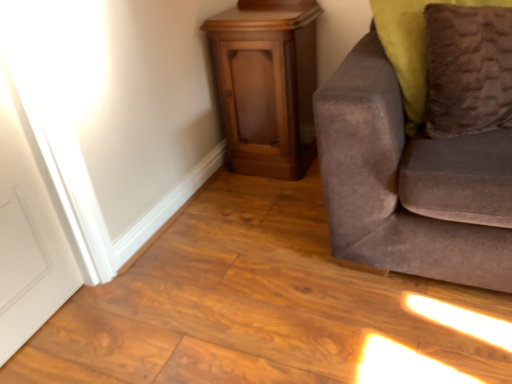
What do you see at coordinates (266, 84) in the screenshot? I see `wooden cabinet at center` at bounding box center [266, 84].

Describe the element at coordinates (467, 69) in the screenshot. The width and height of the screenshot is (512, 384). I see `brown fuzzy pillow at right` at that location.

Image resolution: width=512 pixels, height=384 pixels. Identify the location of wooden cabinet at center. (266, 84).

From the image's perspective, is suede gray couch at right located above wooden cabinet at center?

Incorrect, from the image's perspective, suede gray couch at right is lower than wooden cabinet at center.

Locate an element on the screen. The width and height of the screenshot is (512, 384). studio couch located in front of the wooden cabinet at center is located at coordinates (410, 182).

From the picture: Measure the distance between suede gray couch at right and wooden cabinet at center.

suede gray couch at right and wooden cabinet at center are 28.93 inches apart.

Is suede gray couch at right to the left of wooden cabinet at center from the viewer's perspective?

No, suede gray couch at right is not to the left of wooden cabinet at center.

In terms of height, does wooden cabinet at center look taller or shorter compared to brown fuzzy pillow at right?

In the image, wooden cabinet at center appears to be taller than brown fuzzy pillow at right.

Is wooden cabinet at center completely or partially outside of brown fuzzy pillow at right?

Indeed, wooden cabinet at center is completely outside brown fuzzy pillow at right.

Is the position of wooden cabinet at center less distant than that of brown fuzzy pillow at right?

No, it is not.

Is the surface of wooden cabinet at center in direct contact with brown fuzzy pillow at right?

No.

Consider the image. Can you tell me how much brown fuzzy pillow at right and wooden cabinet at center differ in facing direction?

39.7 degrees.

How much distance is there between brown fuzzy pillow at right and wooden cabinet at center?

brown fuzzy pillow at right and wooden cabinet at center are 30.35 inches apart.

From a real-world perspective, is brown fuzzy pillow at right over wooden cabinet at center?

Yes, from a real-world perspective, brown fuzzy pillow at right is on top of wooden cabinet at center.

Considering the sizes of objects brown fuzzy pillow at right and wooden cabinet at center in the image provided, who is wider, brown fuzzy pillow at right or wooden cabinet at center?

Wider between the two is wooden cabinet at center.

Based on the photo, is suede gray couch at right smaller than brown fuzzy pillow at right?

No.

This screenshot has width=512, height=384. Identify the location of studio couch that is on the left side of brown fuzzy pillow at right. (410, 182).

From the image's perspective, relative to brown fuzzy pillow at right, is suede gray couch at right above or below?

suede gray couch at right is situated lower than brown fuzzy pillow at right in the image.

In the scene shown: Are suede gray couch at right and brown fuzzy pillow at right making contact?

No, suede gray couch at right is not beside brown fuzzy pillow at right.

Is point (285, 100) positioned behind point (431, 240)?

Yes, it is behind point (431, 240).

Where is `studio couch on the right side of wooden cabinet at center`? This screenshot has height=384, width=512. studio couch on the right side of wooden cabinet at center is located at coordinates point(410,182).

Based on their sizes in the image, would you say wooden cabinet at center is bigger or smaller than suede gray couch at right?

Considering their sizes, wooden cabinet at center takes up less space than suede gray couch at right.

Based on the photo, from the image's perspective, which object appears higher, wooden cabinet at center or suede gray couch at right?

wooden cabinet at center appears higher in the image.

Could you tell me if brown fuzzy pillow at right is facing suede gray couch at right?

Yes, brown fuzzy pillow at right faces towards suede gray couch at right.

Is brown fuzzy pillow at right not close to suede gray couch at right?

No.

From a real-world perspective, which is physically above, brown fuzzy pillow at right or suede gray couch at right?

brown fuzzy pillow at right, from a real-world perspective.

From the image's perspective, would you say brown fuzzy pillow at right is positioned over suede gray couch at right?

Yes, from the image's perspective, brown fuzzy pillow at right is over suede gray couch at right.

Identify the location of studio couch in front of the wooden cabinet at center. Image resolution: width=512 pixels, height=384 pixels. (410, 182).

Locate an element on the screen. This screenshot has height=384, width=512. pillow that is on the right side of wooden cabinet at center is located at coordinates (467, 69).

Looking at this image, when comparing their distances from brown fuzzy pillow at right, does suede gray couch at right or wooden cabinet at center seem closer?

Based on the image, suede gray couch at right appears to be nearer to brown fuzzy pillow at right.

Based on their spatial positions, is suede gray couch at right or brown fuzzy pillow at right further from wooden cabinet at center?

brown fuzzy pillow at right is positioned further to the anchor wooden cabinet at center.

Looking at this image, based on their spatial positions, is brown fuzzy pillow at right or wooden cabinet at center further from suede gray couch at right?

wooden cabinet at center is further to suede gray couch at right.

Which object lies nearer to the anchor point brown fuzzy pillow at right, wooden cabinet at center or suede gray couch at right?

Among the two, suede gray couch at right is located nearer to brown fuzzy pillow at right.

Estimate the real-world distances between objects in this image. Which object is closer to wooden cabinet at center, brown fuzzy pillow at right or suede gray couch at right?

suede gray couch at right is closer to wooden cabinet at center.

Looking at the image, which one is located closer to suede gray couch at right, wooden cabinet at center or brown fuzzy pillow at right?

brown fuzzy pillow at right lies closer to suede gray couch at right than the other object.

Image resolution: width=512 pixels, height=384 pixels. What are the coordinates of `pillow between suede gray couch at right and wooden cabinet at center along the z-axis` in the screenshot? It's located at (467, 69).